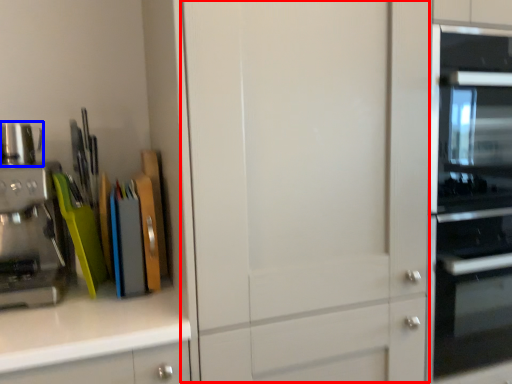
Question: Which of the following is the farthest to the observer, glass door (highlighted by a red box) or appliance (highlighted by a blue box)?

Choices:
 (A) glass door
 (B) appliance

Answer: (B)